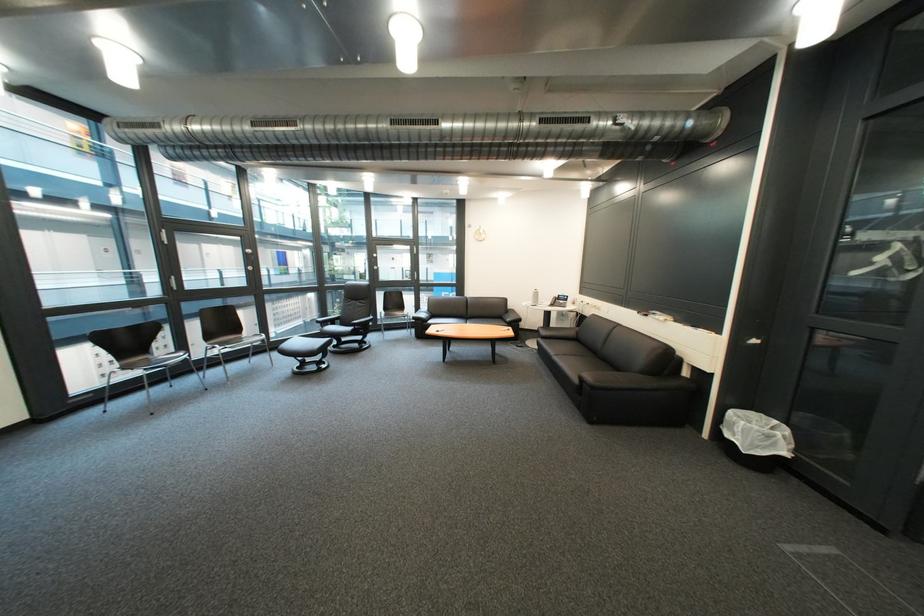
This screenshot has width=924, height=616. Identify the location of the footrest sitting surface. (304, 346).